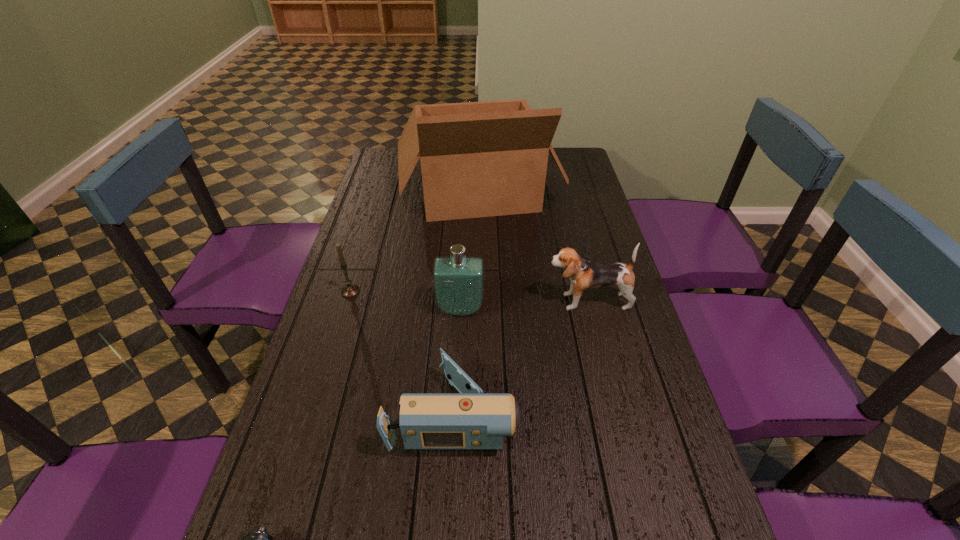
At what (x,y) coordinates should I click in order to perform the action: click on the tallest object. Please return your answer as a coordinate pair (x, y). Looking at the image, I should click on (478, 159).

The width and height of the screenshot is (960, 540). In order to click on box in this screenshot , I will do `click(478, 159)`.

Locate an element on the screen. perfume is located at coordinates (458, 280).

You are a GUI agent. You are given a task and a screenshot of the screen. Output one action in this format:
    pyautogui.click(x=<x>, y=<y>)
    Task: Click on the puppy
    This screenshot has height=540, width=960.
    Given the screenshot: What is the action you would take?
    pyautogui.click(x=584, y=275)

Find the location of `candle`. candle is located at coordinates (350, 290).

Find the location of `camcorder`. camcorder is located at coordinates (470, 420).

This screenshot has height=540, width=960. Identify the location of vacant space located 0.130m on the front of the box. (478, 261).

Locate an element on the screen. vacant area located on the front label of the perfume is located at coordinates (x=455, y=435).

Locate an element on the screen. Image resolution: width=960 pixels, height=540 pixels. vacant space located at the face of the puppy is located at coordinates (471, 301).

You are a GUI agent. You are given a task and a screenshot of the screen. Output one action in this format:
    pyautogui.click(x=<x>, y=<y>)
    Task: Click on the free region located 0.390m at the face of the puppy
    
    Given the screenshot: What is the action you would take?
    pyautogui.click(x=409, y=301)